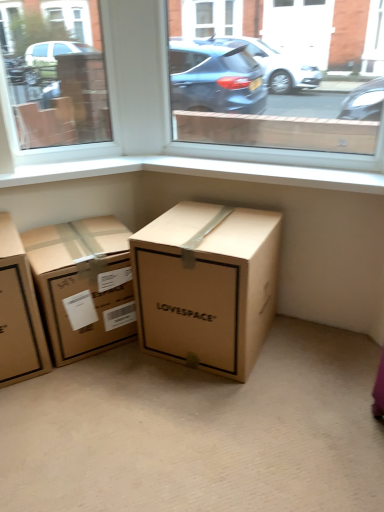
Question: Can you confirm if transparent glass window at center, the 1th window in the right-to-left sequence, is taller than brown cardboard box at center, positioned as the second box in left-to-right order?

Choices:
 (A) no
 (B) yes

Answer: (B)

Question: Does transparent glass window at center, the 1th window in the right-to-left sequence, lie in front of brown cardboard box at center, which is the 2th box in right-to-left order?

Choices:
 (A) yes
 (B) no

Answer: (A)

Question: Can you confirm if transparent glass window at center, the 1th window in the right-to-left sequence, is wider than brown cardboard box at center, which is the 2th box in right-to-left order?

Choices:
 (A) no
 (B) yes

Answer: (A)

Question: Does transparent glass window at center, which is counted as the 2th window, starting from the left, have a smaller size compared to brown cardboard box at center, positioned as the second box in left-to-right order?

Choices:
 (A) no
 (B) yes

Answer: (B)

Question: Would you consider transparent glass window at center, which is counted as the 2th window, starting from the left, to be distant from brown cardboard box at center, positioned as the second box in left-to-right order?

Choices:
 (A) yes
 (B) no

Answer: (B)

Question: In the image, is transparent glass window at center, the 1th window in the right-to-left sequence, positioned in front of or behind white smooth window sill at upper center?

Choices:
 (A) behind
 (B) front

Answer: (B)

Question: Is transparent glass window at center, which is counted as the 2th window, starting from the left, to the left or to the right of white smooth window sill at upper center in the image?

Choices:
 (A) right
 (B) left

Answer: (A)

Question: Based on their sizes in the image, would you say transparent glass window at center, which is counted as the 2th window, starting from the left, is bigger or smaller than white smooth window sill at upper center?

Choices:
 (A) big
 (B) small

Answer: (A)

Question: From a real-world perspective, is transparent glass window at center, the 1th window in the right-to-left sequence, positioned above or below white smooth window sill at upper center?

Choices:
 (A) above
 (B) below

Answer: (A)

Question: Is point (339, 181) closer or farther from the camera than point (132, 311)?

Choices:
 (A) closer
 (B) farther

Answer: (A)

Question: Is white smooth window sill at upper center taller or shorter than brown cardboard box at center, which is the 2th box in right-to-left order?

Choices:
 (A) short
 (B) tall

Answer: (A)

Question: Do you think white smooth window sill at upper center is within brown cardboard box at center, which is the 2th box in right-to-left order, or outside of it?

Choices:
 (A) inside
 (B) outside

Answer: (B)

Question: From the image's perspective, is white smooth window sill at upper center positioned above or below brown cardboard box at center, which is the 2th box in right-to-left order?

Choices:
 (A) above
 (B) below

Answer: (A)

Question: Considering the positions of transparent glass window at upper left, which ranks as the second window in right-to-left order, and brown cardboard box at center, positioned as the second box in left-to-right order, in the image, is transparent glass window at upper left, which ranks as the second window in right-to-left order, taller or shorter than brown cardboard box at center, positioned as the second box in left-to-right order,?

Choices:
 (A) short
 (B) tall

Answer: (B)

Question: From the image's perspective, is transparent glass window at upper left, which ranks as the second window in right-to-left order, located above or below brown cardboard box at center, positioned as the second box in left-to-right order?

Choices:
 (A) above
 (B) below

Answer: (A)